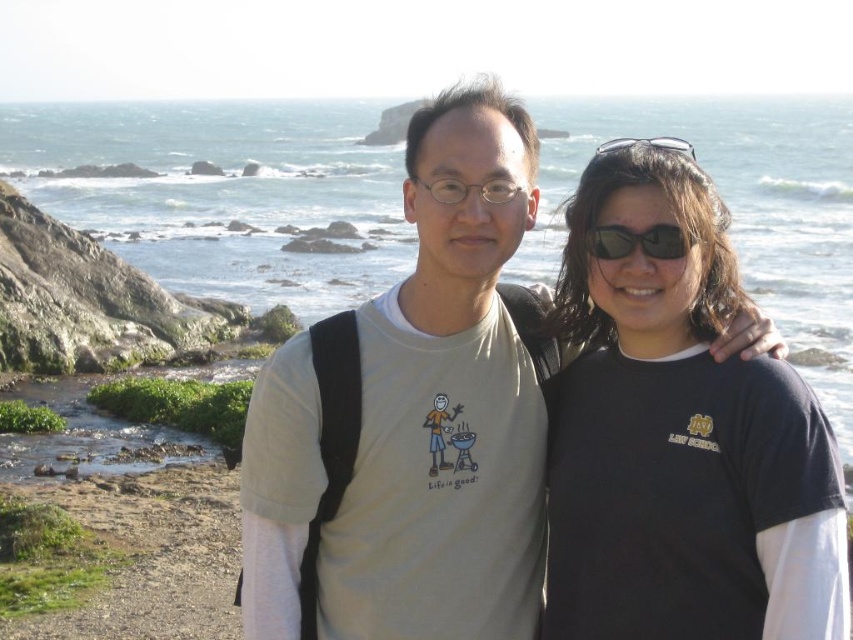
Based on the coordinates provided, which object corresponds to the point at (445,403)?

The beige cotton t shirt at center corresponds to the point at (445,403).